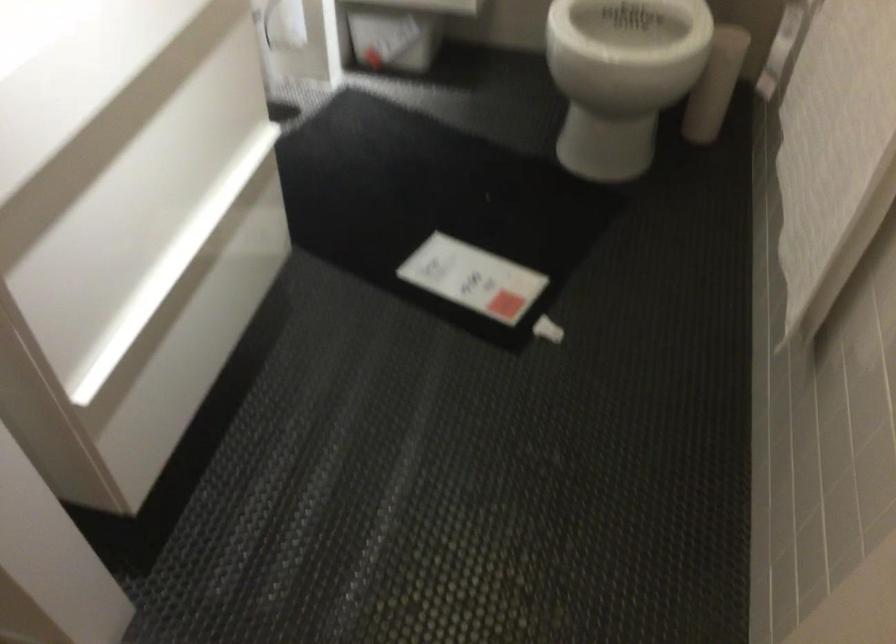
Image resolution: width=896 pixels, height=644 pixels. What do you see at coordinates (622, 77) in the screenshot? I see `the white toilet lid` at bounding box center [622, 77].